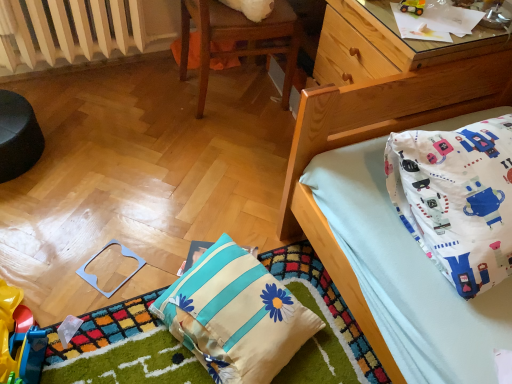
Question: From a real-world perspective, is metallic yellow toy car at upper right, arranged as the third toy when ordered from the bottom, positioned above or below white fabric pillow at upper right, the 2th pillow positioned from the left?

Choices:
 (A) below
 (B) above

Answer: (B)

Question: In terms of width, does metallic yellow toy car at upper right, which is the 3th toy from left to right, look wider or thinner when compared to white fabric pillow at upper right, the 1th pillow positioned from the right?

Choices:
 (A) wide
 (B) thin

Answer: (B)

Question: Which of these objects is positioned farthest from the white fabric pillow at upper right, the 1th pillow positioned from the right?

Choices:
 (A) metallic yellow toy car at upper right, the 1th toy viewed from the right
 (B) rubberized plastic toy at lower left, which ranks as the 1th toy in bottom-to-top order
 (C) white fabric pillow with blue stripes and flower design at lower center, positioned as the 2th pillow in right-to-left order
 (D) white painted metal radiator at upper left
 (E) wooden chair at upper center

Answer: (D)

Question: Estimate the real-world distances between objects in this image. Which object is farther from the white fabric pillow with blue stripes and flower design at lower center, which is counted as the 1th pillow, starting from the left?

Choices:
 (A) wooden chair at upper center
 (B) white fabric pillow at upper right, the 2th pillow positioned from the left
 (C) light blue plastic square at lower left, which is the 2th toy from bottom to top
 (D) metallic yellow toy car at upper right, which is the 3th toy from left to right
 (E) white painted metal radiator at upper left

Answer: (E)